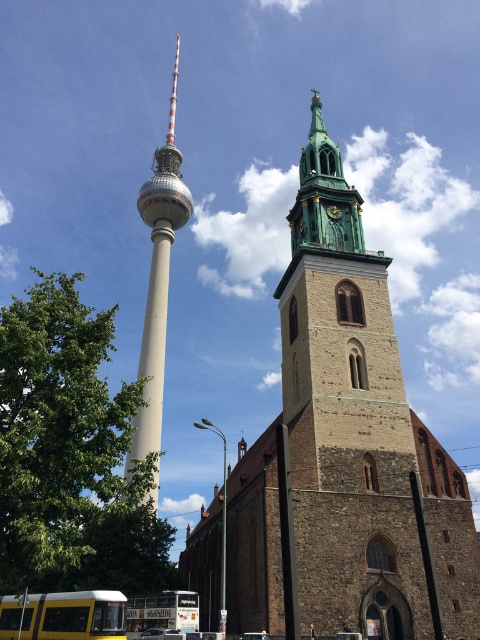
You are an urban planner reviewing a city map that includes both the brown stone church at center and the white concrete spire at center. Based on their spatial footprint, which structure would require more land for construction?

The white concrete spire at center requires more land for construction because it occupies more space than the brown stone church at center.

You are standing at the base of the Fernsehturm and want to take a photo of the church on the right. There are two points marked in the scene at coordinates point (187, 534) and point (189, 211). Which point should you stand at to ensure the Fernsehturm does not block your view of the church?

You should stand at point (189, 211) because point (187, 534) is behind it, meaning the Fernsehturm might block the view from the latter point.